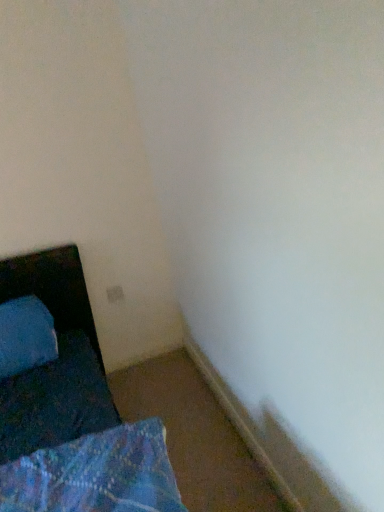
Locate an element on the screen. The image size is (384, 512). blue fabric at lower left is located at coordinates (53, 288).

What do you see at coordinates (53, 288) in the screenshot? The width and height of the screenshot is (384, 512). I see `blue fabric at lower left` at bounding box center [53, 288].

I want to click on blue fabric at lower left, so click(x=53, y=288).